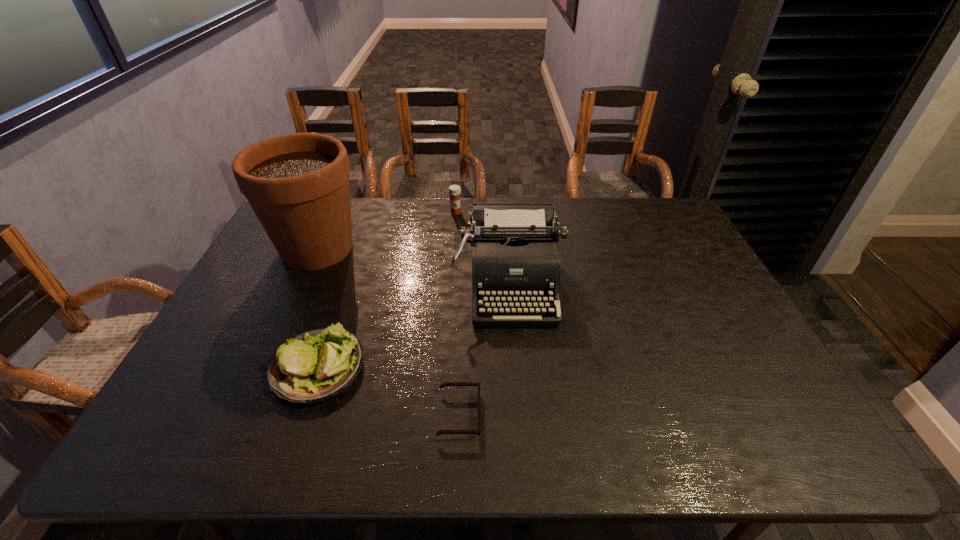
The image size is (960, 540). In order to click on free spot located 0.200m on the front-facing side of the shortest object in this screenshot , I will do (569, 414).

The height and width of the screenshot is (540, 960). In order to click on flowerpot located at the far edge in this screenshot , I will do `click(297, 184)`.

In order to click on medicine that is at the far edge in this screenshot , I will do `click(454, 190)`.

The image size is (960, 540). Identify the location of object that is at the near edge. (442, 385).

Locate an element on the screen. Image resolution: width=960 pixels, height=540 pixels. object that is at the left edge is located at coordinates (297, 184).

I want to click on object situated at the far left corner, so click(297, 184).

Identify the location of free region at the far edge of the desktop. The height and width of the screenshot is (540, 960). (404, 214).

This screenshot has height=540, width=960. I want to click on vacant space at the near edge of the desktop, so click(614, 441).

You are a GUI agent. You are given a task and a screenshot of the screen. Output one action in this format:
    pyautogui.click(x=<x>, y=<y>)
    Task: Click on the free space at the left edge of the desktop
    The image size is (960, 540).
    Given the screenshot: What is the action you would take?
    pyautogui.click(x=172, y=397)

In the image, there is a desktop. Where is `free space at the right edge`? The height and width of the screenshot is (540, 960). free space at the right edge is located at coordinates (702, 282).